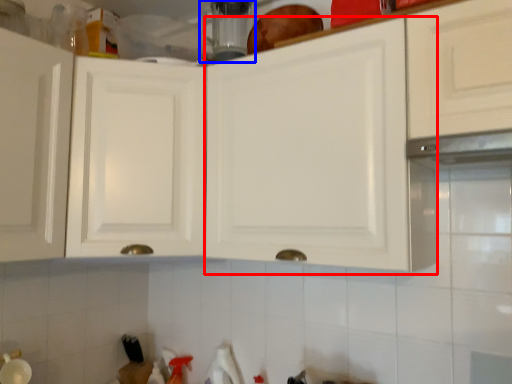
Question: Which object appears farthest to the camera in this image, cabinetry (highlighted by a red box) or appliance (highlighted by a blue box)?

Choices:
 (A) cabinetry
 (B) appliance

Answer: (B)